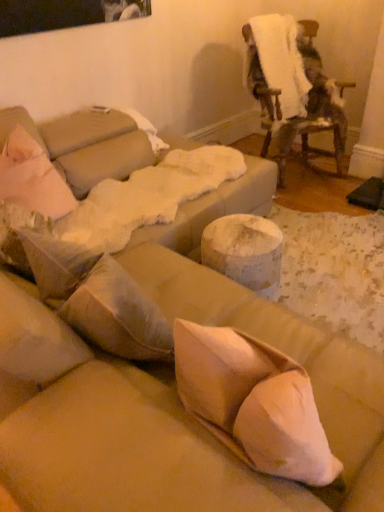
Question: Is white fluffy blanket at upper right aimed at fuzzy white blanket at upper right?

Choices:
 (A) yes
 (B) no

Answer: (A)

Question: Is white fluffy blanket at upper right far from fuzzy white blanket at upper right?

Choices:
 (A) no
 (B) yes

Answer: (A)

Question: Does white fluffy blanket at upper right have a lesser height compared to fuzzy white blanket at upper right?

Choices:
 (A) no
 (B) yes

Answer: (B)

Question: Is white fluffy blanket at upper right thinner than fuzzy white blanket at upper right?

Choices:
 (A) yes
 (B) no

Answer: (A)

Question: Is white fluffy blanket at upper right completely or partially outside of fuzzy white blanket at upper right?

Choices:
 (A) yes
 (B) no

Answer: (B)

Question: Is white fluffy blanket at upper right at the left side of fuzzy white blanket at upper right?

Choices:
 (A) no
 (B) yes

Answer: (B)

Question: Is fuzzy white blanket at upper right facing away from white fluffy blanket at upper right?

Choices:
 (A) yes
 (B) no

Answer: (A)

Question: Can you confirm if fuzzy white blanket at upper right is smaller than white fluffy blanket at upper right?

Choices:
 (A) no
 (B) yes

Answer: (A)

Question: Is the depth of fuzzy white blanket at upper right less than that of white fluffy blanket at upper right?

Choices:
 (A) no
 (B) yes

Answer: (B)

Question: Is fuzzy white blanket at upper right at the right side of white fluffy blanket at upper right?

Choices:
 (A) no
 (B) yes

Answer: (B)

Question: Would you say fuzzy white blanket at upper right is a long distance from white fluffy blanket at upper right?

Choices:
 (A) yes
 (B) no

Answer: (B)

Question: From the image's perspective, does fuzzy white blanket at upper right appear higher than white fluffy blanket at upper right?

Choices:
 (A) yes
 (B) no

Answer: (B)

Question: In terms of width, does white fluffy blanket at upper right look wider or thinner when compared to fuzzy white blanket at upper right?

Choices:
 (A) thin
 (B) wide

Answer: (A)